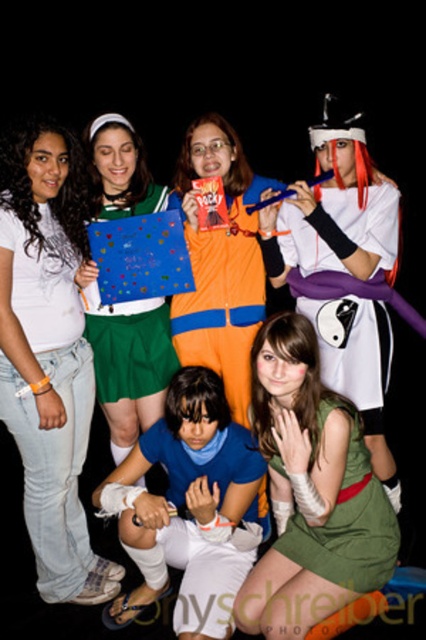
Can you confirm if green satin dress at center is positioned to the left of green fabric dress at lower right?

Correct, you'll find green satin dress at center to the left of green fabric dress at lower right.

Between point (336, 566) and point (359, 420), which one is positioned behind?

Positioned behind is point (359, 420).

Where is `green satin dress at center`? green satin dress at center is located at coordinates (310, 492).

Which is more to the left, blue fabric shirt at center or orange fabric jacket at center?

blue fabric shirt at center is more to the left.

Is the position of blue fabric shirt at center less distant than that of orange fabric jacket at center?

Yes, it is.

Between point (132, 548) and point (216, 168), which one is positioned in front?

Point (132, 548) is more forward.

I want to click on blue fabric shirt at center, so click(x=189, y=506).

Who is taller, green satin dress at center or matte green skirt at center?

With more height is green satin dress at center.

Is green satin dress at center to the right of matte green skirt at center from the viewer's perspective?

Yes, green satin dress at center is to the right of matte green skirt at center.

Is point (290, 380) behind point (120, 305)?

No, (290, 380) is closer to viewer.

The width and height of the screenshot is (426, 640). I want to click on green satin dress at center, so click(310, 492).